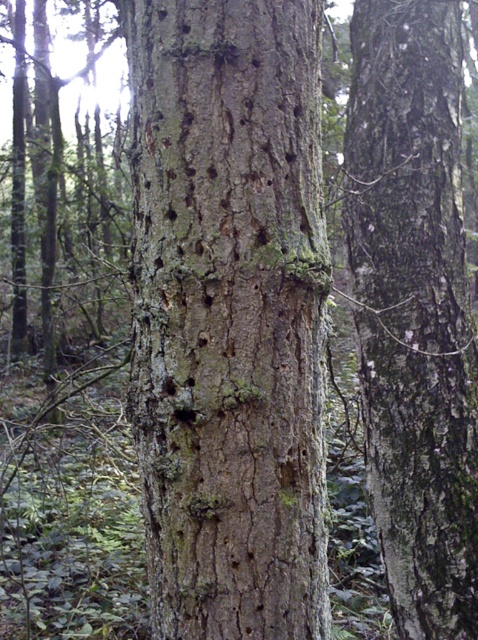
Question: Does rough bark tree trunk at center have a lesser width compared to smooth brown bark at center?

Choices:
 (A) yes
 (B) no

Answer: (A)

Question: Can you confirm if rough bark tree trunk at center is positioned below smooth brown bark at center?

Choices:
 (A) no
 (B) yes

Answer: (B)

Question: Which of the following is the farthest from the observer?

Choices:
 (A) (381, 298)
 (B) (262, 582)

Answer: (A)

Question: Can you confirm if rough bark tree trunk at center is smaller than smooth brown bark at center?

Choices:
 (A) yes
 (B) no

Answer: (A)